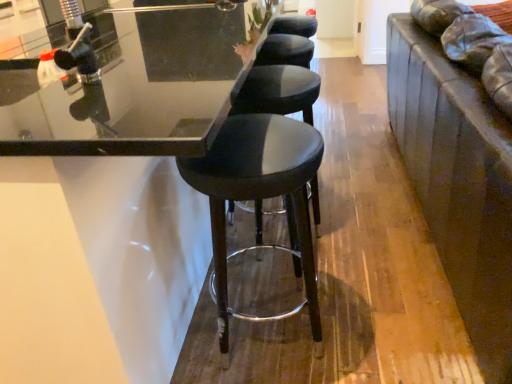
Identify the location of vacant space in between black leather stool at center, which is counted as the second stool, starting from the front, and black leather stool at center, which is the first stool from front to back. The height and width of the screenshot is (384, 512). (266, 274).